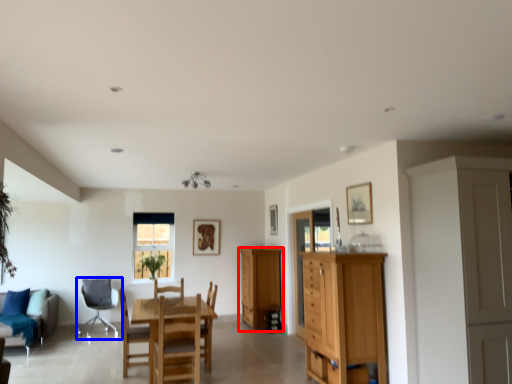
Question: Which object is further to the camera taking this photo, cabinetry (highlighted by a red box) or chair (highlighted by a blue box)?

Choices:
 (A) cabinetry
 (B) chair

Answer: (A)